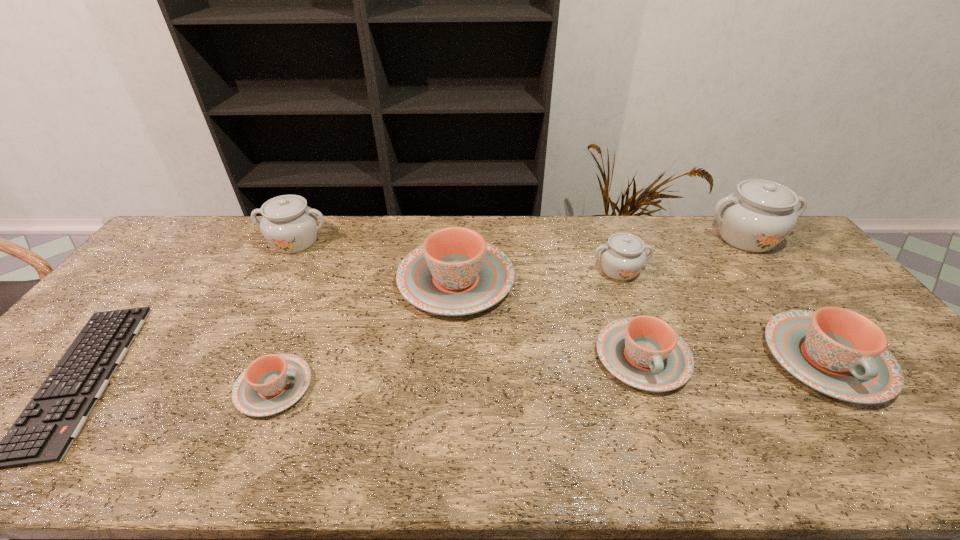
Image resolution: width=960 pixels, height=540 pixels. Find the location of `vacant space located 0.250m on the handle side of the leftmost pink chinaware`. vacant space located 0.250m on the handle side of the leftmost pink chinaware is located at coordinates (414, 387).

The height and width of the screenshot is (540, 960). Identify the location of object that is at the far right corner. (757, 217).

Find the location of a particular element. Image resolution: width=960 pixels, height=540 pixels. free space at the far edge is located at coordinates (684, 242).

In order to click on vacant space at the near edge in this screenshot , I will do `click(185, 455)`.

Identify the location of free space at the left edge of the desktop. (63, 353).

At what (x,y) coordinates should I click in order to perform the action: click on vacant space at the right edge of the desktop. Please return your answer as a coordinate pair (x, y). Looking at the image, I should click on (802, 304).

Find the location of a particular element. The image size is (960, 540). free location at the far left corner is located at coordinates (213, 238).

The width and height of the screenshot is (960, 540). In order to click on vacant area that lies between the second shortest object and the rightmost pink chinaware in this screenshot , I will do `click(550, 373)`.

I want to click on free space that is in between the smallest white chinaware and the tallest chinaware, so click(683, 254).

Image resolution: width=960 pixels, height=540 pixels. I want to click on vacant area that lies between the smallest white chinaware and the sixth tallest object, so click(631, 313).